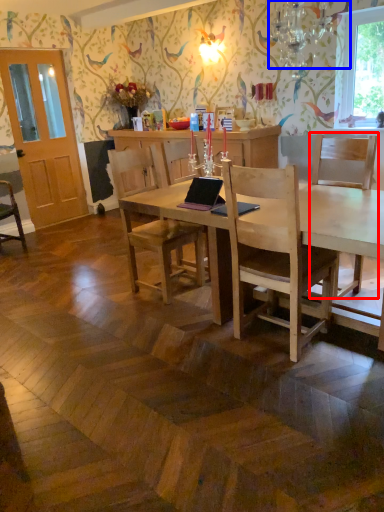
Question: Which of the following is the farthest to the observer, chair (highlighted by a red box) or lamp (highlighted by a blue box)?

Choices:
 (A) chair
 (B) lamp

Answer: (A)